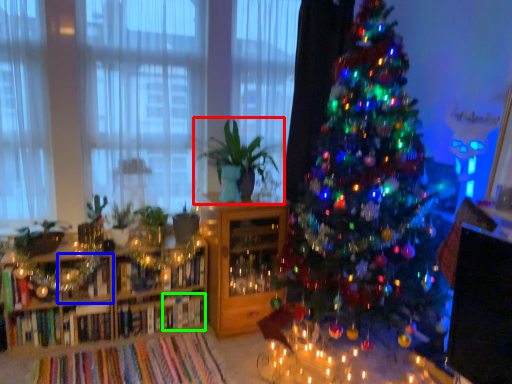
Question: Considering the real-world distances, which object is closest to houseplant (highlighted by a red box)? shelf (highlighted by a blue box) or book (highlighted by a green box).

Choices:
 (A) shelf
 (B) book

Answer: (B)